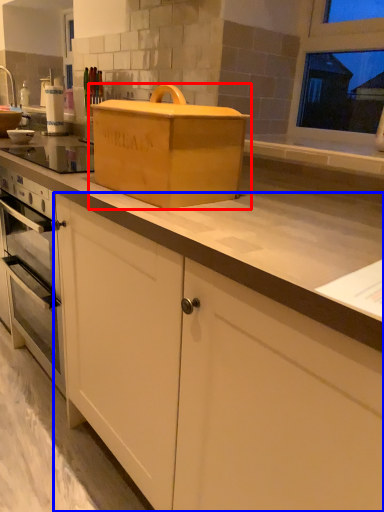
Question: Which object appears farthest to the camera in this image, cardboard box (highlighted by a red box) or cabinetry (highlighted by a blue box)?

Choices:
 (A) cardboard box
 (B) cabinetry

Answer: (B)